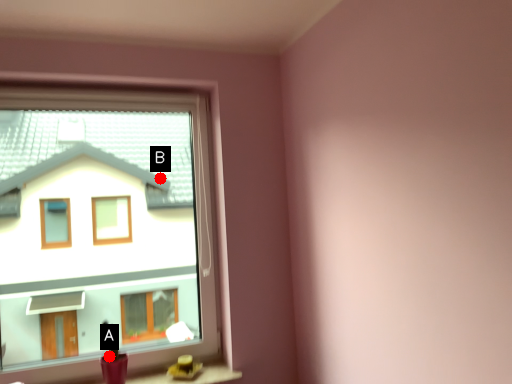
Question: Two points are circled on the image, labeled by A and B beside each circle. Which point is farther from the camera taking this photo?

Choices:
 (A) A is further
 (B) B is further

Answer: (B)